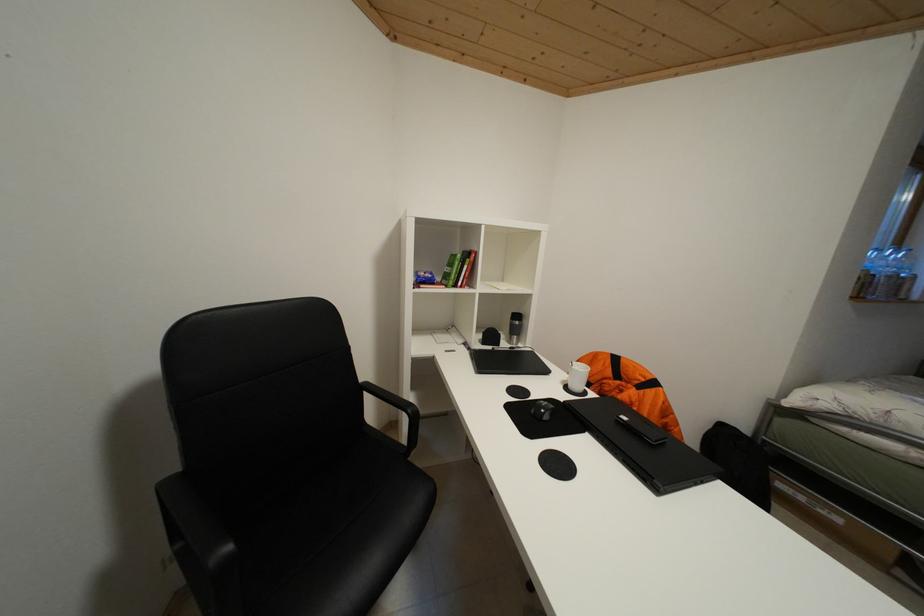
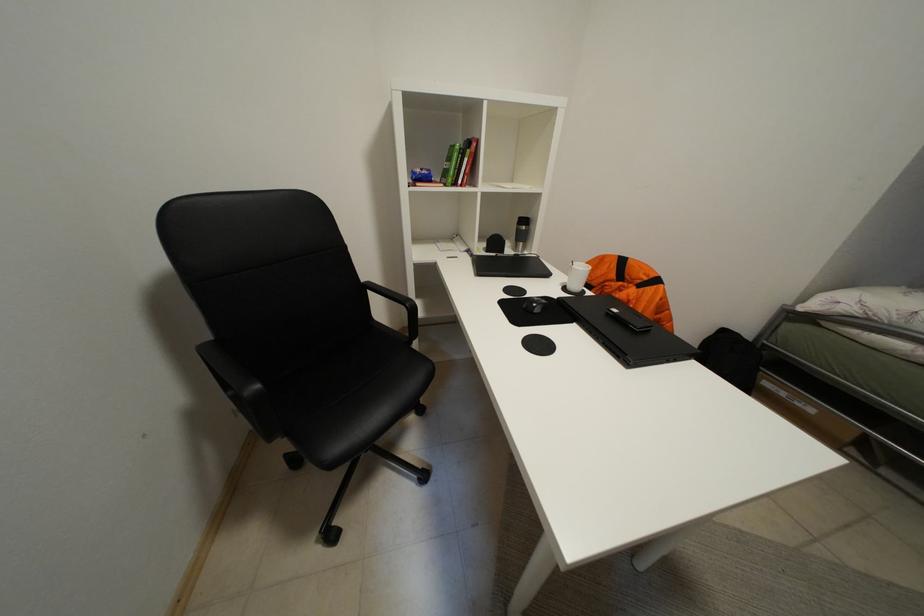
Question: The images are taken continuously from a first-person perspective. In which direction is your viewpoint rotating?

Choices:
 (A) Left
 (B) Right
 (C) Up
 (D) Down

Answer: (D)